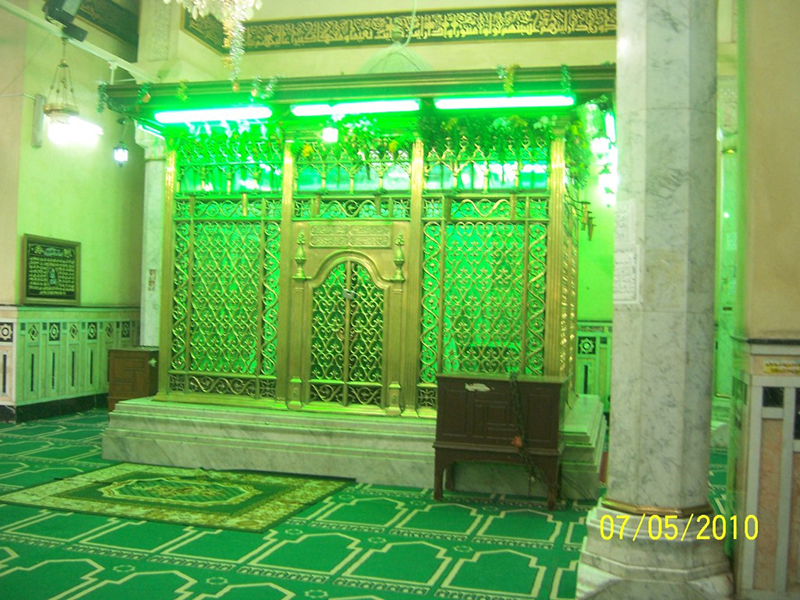
Find the location of a particular element. This screenshot has width=800, height=600. column is located at coordinates (665, 264), (146, 268).